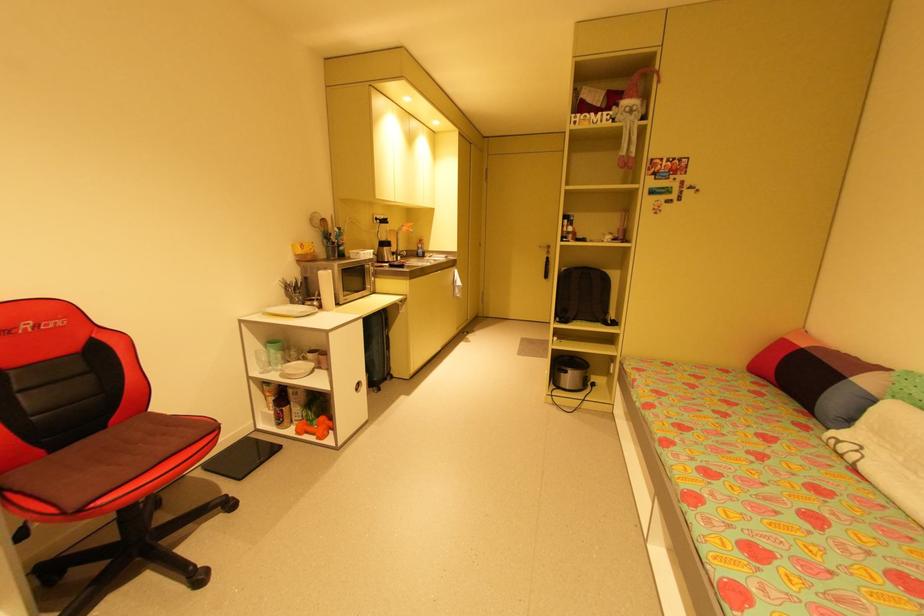
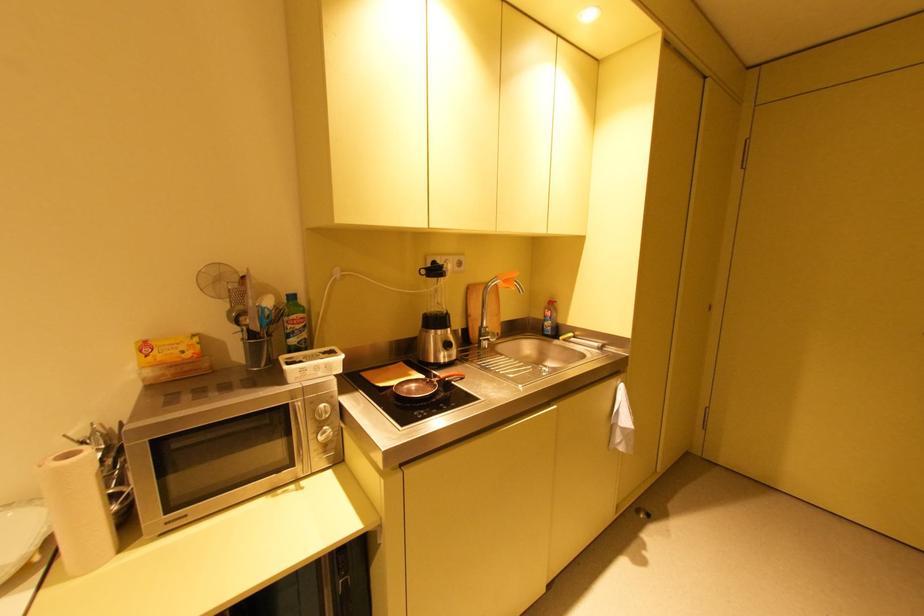
Find the pixel in the second image that matches point 423,251 in the first image.

(551, 323)